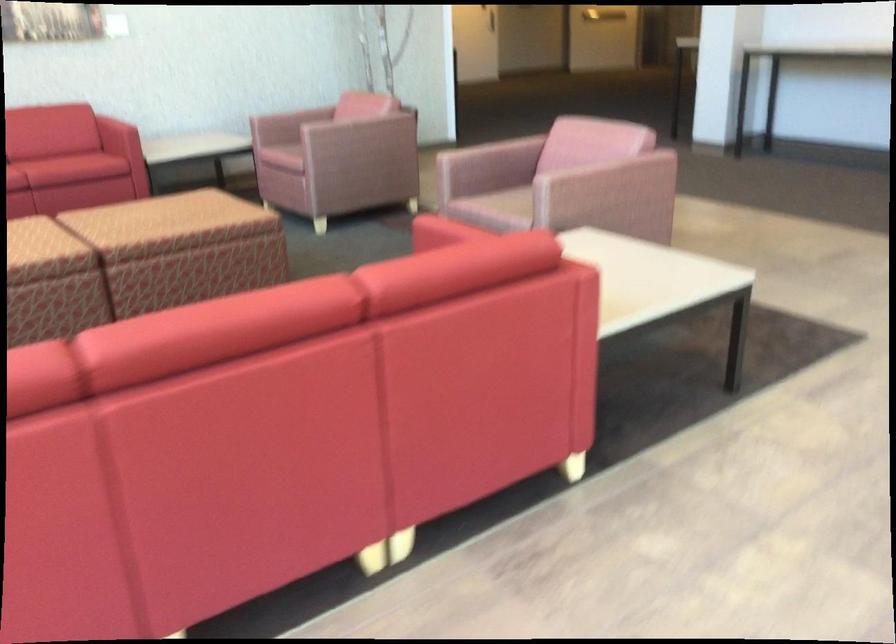
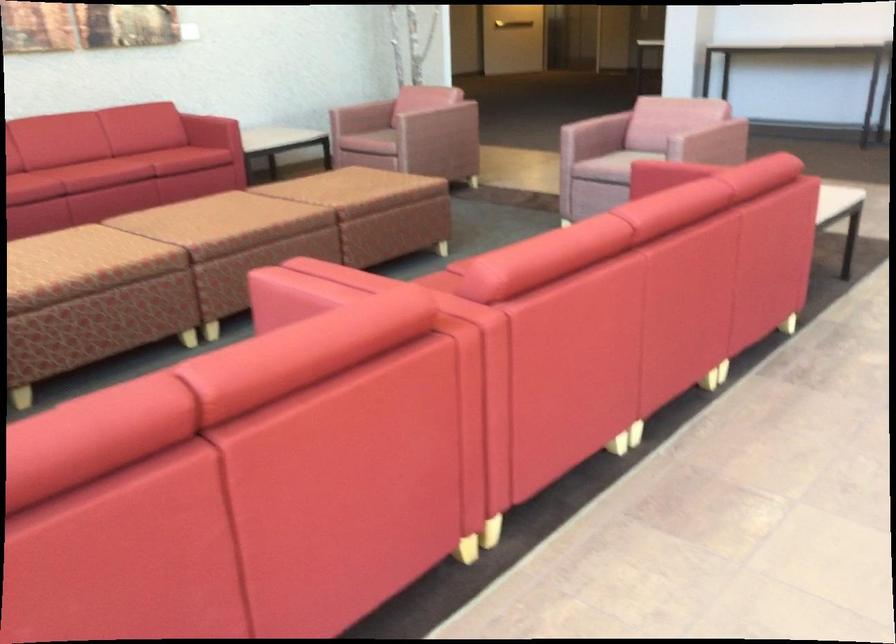
Locate, in the second image, the point that corresponds to (x=150, y=243) in the first image.

(380, 212)